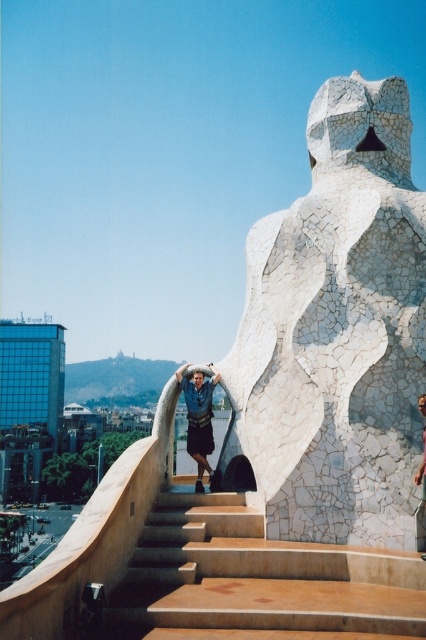
You are a photographer trying to capture a wide shot of the brown stone stairs at center and the blue denim shorts at upper center. Which object is wider in the image?

The brown stone stairs at center is wider than the blue denim shorts at upper center.

Looking at this image, you are an architect designing a new sculpture garden. You want to place a new sculpture that is 3 meters wide between the white mosaic statue at center and the brown stone stairs at center. Is there enough space between them to accommodate the sculpture?

The white mosaic statue at center and brown stone stairs at center are 10.89 meters apart from each other, so there is sufficient space to place a 3 meter wide sculpture between them.

You are a photographer standing at the base of the white mosaic statue at center. You want to take a photo that captures the entire statue in the frame. Given that your camera has a maximum focal length of 24mm, which is best for wide shots, and you can move closer or farther away, what is the minimum distance you need to be from the statue to ensure it fits in the frame?

The white mosaic statue at center is 47.74 meters away from the camera. Since the statue is already at this distance and your camera can capture wide shots with a 24mm lens, you can move closer than 47.74 meters to ensure the entire statue fits in the frame.